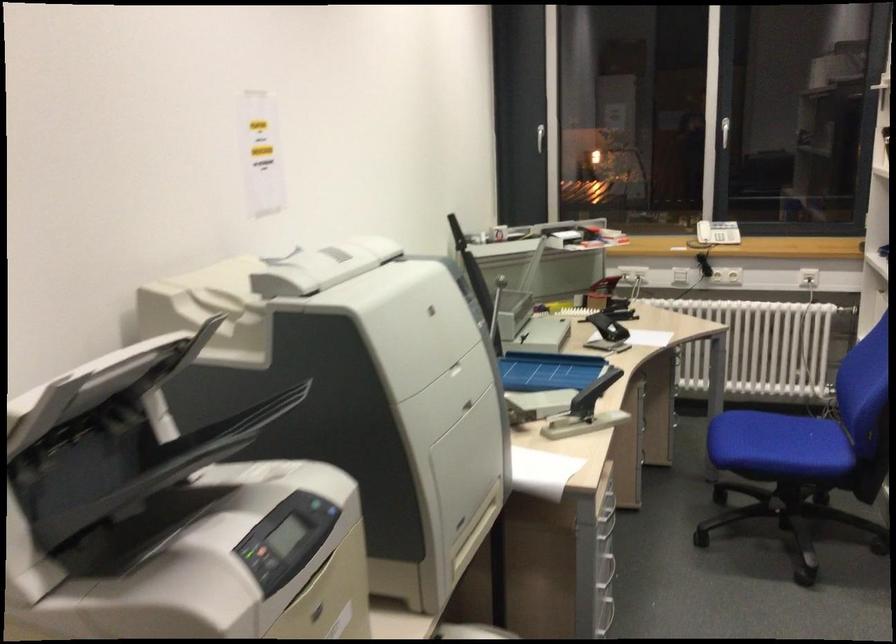
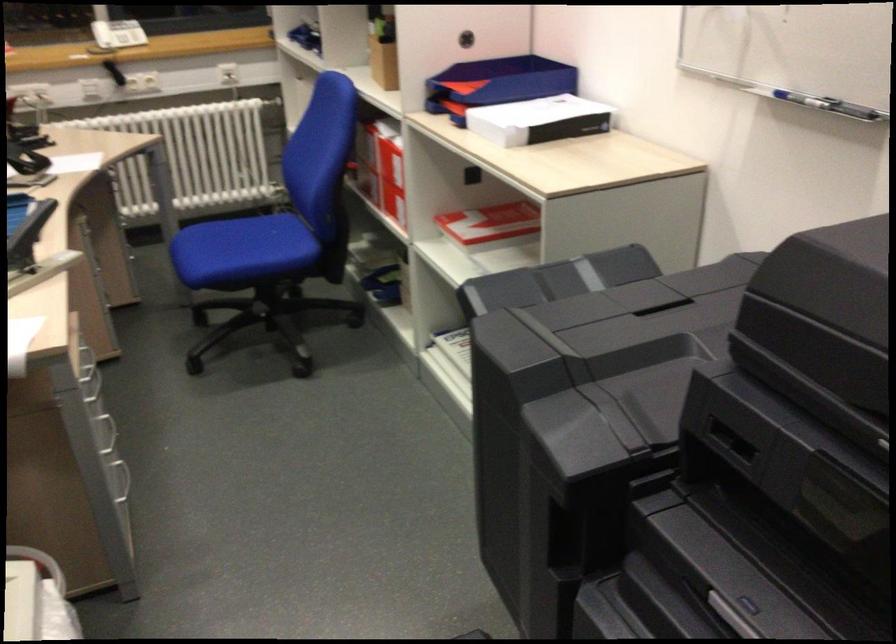
Where in the second image is the point corresponding to (x=601, y=552) from the first image?

(101, 419)